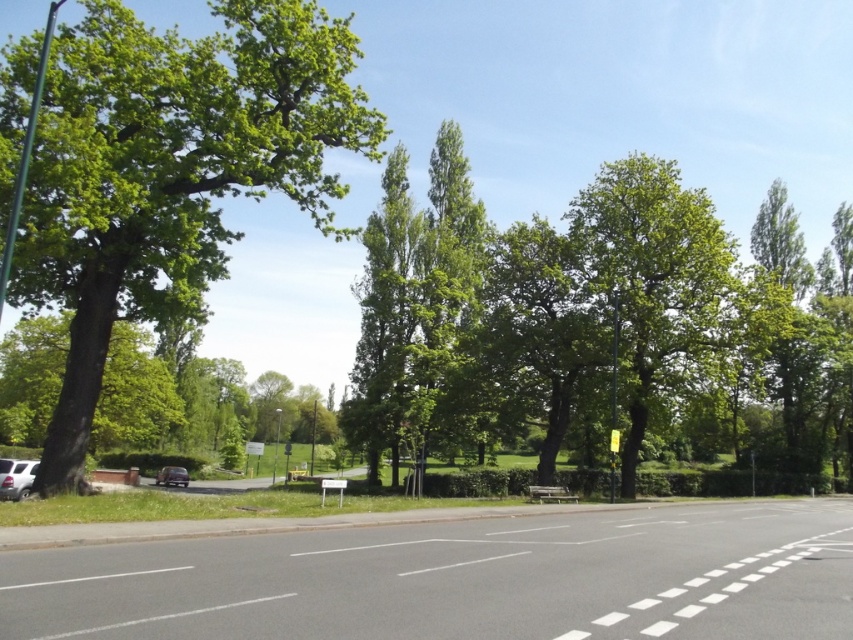
Question: Is green leafy tree at left thinner than white matte car at lower left?

Choices:
 (A) no
 (B) yes

Answer: (A)

Question: Can you confirm if white matte car at lower left is positioned to the right of shiny black car at center?

Choices:
 (A) no
 (B) yes

Answer: (B)

Question: Which object is positioned farthest from the shiny black car at center?

Choices:
 (A) green leafy tree at center
 (B) green leafy tree at left
 (C) white matte car at lower left

Answer: (A)

Question: Can you confirm if green leafy tree at center is positioned above green leafy tree at left?

Choices:
 (A) no
 (B) yes

Answer: (A)

Question: Which of these objects is positioned farthest from the green leafy tree at left?

Choices:
 (A) white matte car at lower left
 (B) green leafy tree at center
 (C) shiny black car at center

Answer: (B)

Question: Which point is closer to the camera taking this photo?

Choices:
 (A) (38, 464)
 (B) (132, 225)

Answer: (B)